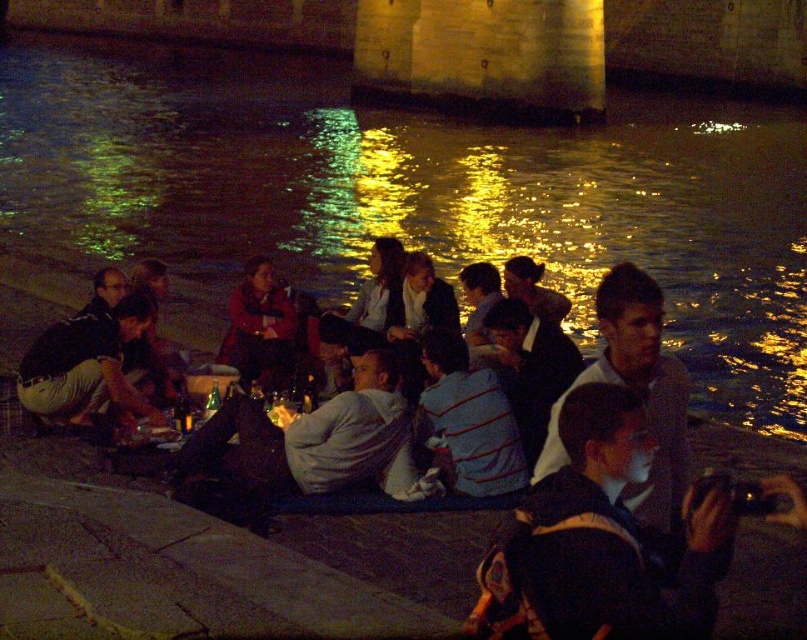
What do you see at coordinates (605, 540) in the screenshot? The image size is (807, 640). I see `black fabric jacket at lower right` at bounding box center [605, 540].

This screenshot has height=640, width=807. What are the coordinates of `black fabric jacket at lower right` in the screenshot? It's located at (605, 540).

Can you confirm if light brown hair at center is taller than light brown leather jacket at lower left?

Yes.

Does light brown hair at center appear under light brown leather jacket at lower left?

No.

Between point (680, 413) and point (90, 320), which one is positioned behind?

Point (90, 320)

Identify the location of light brown hair at center. (644, 387).

Which of these two, light brown hair at center or matte red jacket at center, stands shorter?

Standing shorter between the two is matte red jacket at center.

Is point (651, 372) more distant than point (231, 301)?

No, (651, 372) is closer to viewer.

What do you see at coordinates (644, 387) in the screenshot? This screenshot has width=807, height=640. I see `light brown hair at center` at bounding box center [644, 387].

Locate an element on the screen. light brown hair at center is located at coordinates (644, 387).